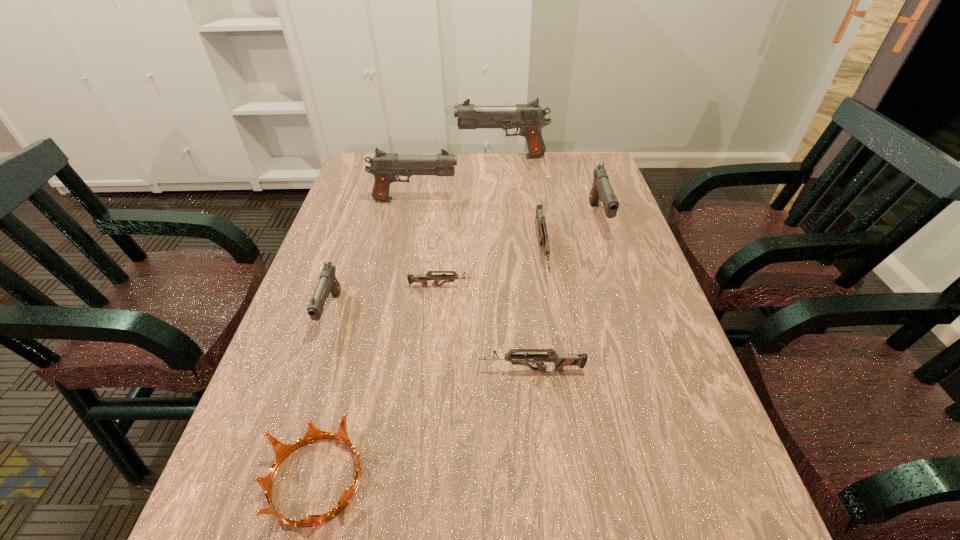
Locate which gray gun ranks second in proximity to the sixth shortest object. Please provide its 2D coordinates. Your answer should be formatted as a tuple, i.e. [(x, y)], where the tuple contains the x and y coordinates of a point satisfying the conditions above.

[(384, 166)]

The image size is (960, 540). I want to click on grey gun that stands as the third closest to the farthest gray gun, so click(x=560, y=360).

Select which grey gun is the third closest to the crown. Please provide its 2D coordinates. Your answer should be formatted as a tuple, i.e. [(x, y)], where the tuple contains the x and y coordinates of a point satisfying the conditions above.

[(542, 229)]

Find the location of a particular element. Image resolution: width=960 pixels, height=540 pixels. blank space that satisfies the following two spatial constraints: 1. aimed along the barrel of the shortest object; 2. in the direction the nearest gray gun is aimed is located at coordinates (439, 312).

Where is `blank space that satisfies the following two spatial constraints: 1. in the direction the tallest gun is aimed; 2. on the front side of the nearest object`? Image resolution: width=960 pixels, height=540 pixels. blank space that satisfies the following two spatial constraints: 1. in the direction the tallest gun is aimed; 2. on the front side of the nearest object is located at coordinates (525, 479).

You are a GUI agent. You are given a task and a screenshot of the screen. Output one action in this format:
    pyautogui.click(x=<x>, y=<y>)
    Task: Click on the free location that satisfies the following two spatial constraints: 1. aimed along the barrel of the smallest grey gun; 2. in the direction the nearest gray gun is aimed
    Image resolution: width=960 pixels, height=540 pixels.
    Given the screenshot: What is the action you would take?
    pyautogui.click(x=439, y=312)

The height and width of the screenshot is (540, 960). I want to click on vacant region that satisfies the following two spatial constraints: 1. in the direction the third smallest gray gun is aimed; 2. in the direction the nearest gray gun is aimed, so click(x=393, y=312).

The image size is (960, 540). What are the coordinates of `free spot that satisfies the following two spatial constraints: 1. in the direction the tallest gun is aimed; 2. in the direction the nearest gray gun is aimed` in the screenshot? It's located at (513, 312).

Find the location of `free space that satisfies the following two spatial constraints: 1. aimed along the barrel of the third shortest gun; 2. aimed along the barrel of the nearest gun`. free space that satisfies the following two spatial constraints: 1. aimed along the barrel of the third shortest gun; 2. aimed along the barrel of the nearest gun is located at coordinates (562, 370).

The image size is (960, 540). What are the coordinates of `free space that satisfies the following two spatial constraints: 1. aimed along the barrel of the biggest grey gun; 2. aimed along the barrel of the smallest grey gun` in the screenshot? It's located at (548, 286).